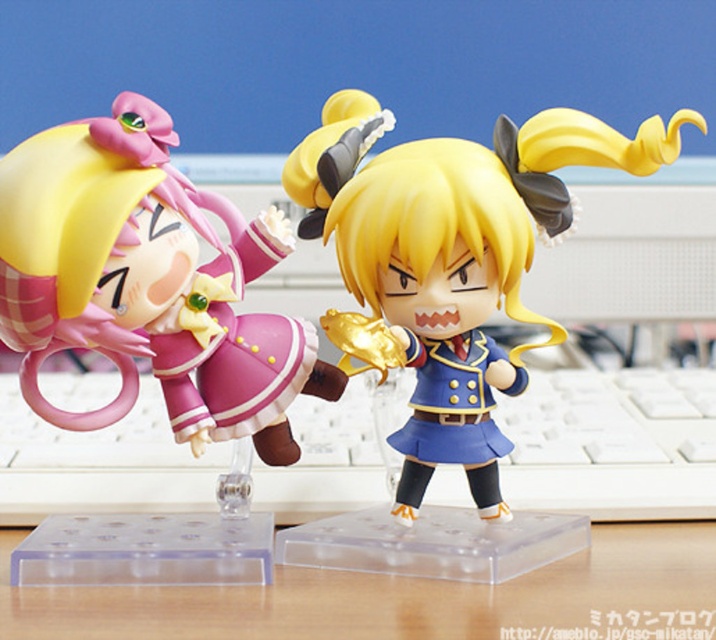
Is point (125, 280) behind point (657, 586)?

Yes, point (125, 280) is farther from viewer.

Which is in front, point (279, 388) or point (334, 628)?

Positioned in front is point (334, 628).

I want to click on matte pink plastic toy at left, so click(x=147, y=282).

Is white plastic keyboard at center below wooden table at center?

No.

Can you confirm if white plastic keyboard at center is positioned to the left of wooden table at center?

Correct, you'll find white plastic keyboard at center to the left of wooden table at center.

Image resolution: width=716 pixels, height=640 pixels. Describe the element at coordinates (614, 444) in the screenshot. I see `white plastic keyboard at center` at that location.

Locate an element on the screen. Image resolution: width=716 pixels, height=640 pixels. white plastic keyboard at center is located at coordinates (614, 444).

Who is shorter, matte pink plastic toy at left or blue glossy figure at center?

matte pink plastic toy at left

Who is positioned more to the left, matte pink plastic toy at left or blue glossy figure at center?

matte pink plastic toy at left is more to the left.

The width and height of the screenshot is (716, 640). What are the coordinates of `matte pink plastic toy at left` in the screenshot? It's located at (147, 282).

Where is `matte pink plastic toy at left`? matte pink plastic toy at left is located at coordinates (147, 282).